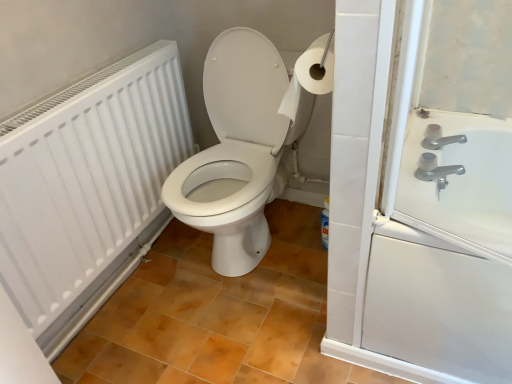
In the scene shown: Measure the distance between point (206, 179) and camera.

The depth of point (206, 179) is 5.38 feet.

Locate an element on the screen. This screenshot has height=384, width=512. satin nickel faucet at upper right is located at coordinates (435, 170).

The width and height of the screenshot is (512, 384). Find the location of `white paper at upper right`. white paper at upper right is located at coordinates (310, 76).

Does white matte radiator at left lie behind satin nickel faucet at upper right?

No.

Considering the relative positions of white matte radiator at left and satin nickel faucet at upper right in the image provided, is white matte radiator at left to the left or to the right of satin nickel faucet at upper right?

From the image, it's evident that white matte radiator at left is to the left of satin nickel faucet at upper right.

Which is in front, point (161, 84) or point (428, 164)?

Positioned in front is point (428, 164).

How many degrees apart are the facing directions of white matte radiator at left and satin nickel faucet at upper right?

The angle between the facing direction of white matte radiator at left and the facing direction of satin nickel faucet at upper right is 0.399 degrees.

Considering the relative positions of white glossy toilet at center and white paper at upper right in the image provided, is white glossy toilet at center to the left or to the right of white paper at upper right?

white glossy toilet at center is positioned on white paper at upper right's left side.

From a real-world perspective, which object rests below the other?

white glossy toilet at center is physically lower.

Based on the photo, which of these two, white glossy toilet at center or white paper at upper right, is smaller?

Answer: white paper at upper right.

What's the angular difference between white glossy toilet at center and white paper at upper right's facing directions?

There is a 92.6-degree angle between the facing directions of white glossy toilet at center and white paper at upper right.

From a real-world perspective, is white paper at upper right over white glossy toilet at center?

Yes, from a real-world perspective, white paper at upper right is on top of white glossy toilet at center.

Who is taller, white paper at upper right or white glossy toilet at center?

white glossy toilet at center.

Would you say white paper at upper right is a long distance from white glossy toilet at center?

white paper at upper right is near white glossy toilet at center, not far away.

Is white paper at upper right to the left of white glossy toilet at center from the viewer's perspective?

Incorrect, white paper at upper right is not on the left side of white glossy toilet at center.

In the scene shown: Is white paper at upper right wider or thinner than satin nickel faucet at upper right?

Clearly, white paper at upper right has more width compared to satin nickel faucet at upper right.

Is white paper at upper right not inside satin nickel faucet at upper right?

Yes, white paper at upper right is outside of satin nickel faucet at upper right.

Is white paper at upper right taller or shorter than satin nickel faucet at upper right?

Considering their sizes, white paper at upper right has more height than satin nickel faucet at upper right.

Who is bigger, white paper at upper right or satin nickel faucet at upper right?

With larger size is white paper at upper right.

Does satin nickel faucet at upper right have a lesser width compared to white paper at upper right?

Indeed, satin nickel faucet at upper right has a lesser width compared to white paper at upper right.

Is satin nickel faucet at upper right far from white paper at upper right?

satin nickel faucet at upper right is actually quite close to white paper at upper right.

Is point (442, 171) farther from viewer compared to point (310, 47)?

Yes.

Does satin nickel faucet at upper right have a smaller size compared to white paper at upper right?

Correct, satin nickel faucet at upper right occupies less space than white paper at upper right.

Is white matte radiator at left not inside white glossy toilet at center?

Yes, white matte radiator at left is outside of white glossy toilet at center.

Is white matte radiator at left behind white glossy toilet at center?

No, it is in front of white glossy toilet at center.

Does white matte radiator at left appear on the left side of white glossy toilet at center?

Correct, you'll find white matte radiator at left to the left of white glossy toilet at center.

Considering the sizes of white matte radiator at left and white glossy toilet at center in the image, is white matte radiator at left taller or shorter than white glossy toilet at center?

In the image, white matte radiator at left appears to be shorter than white glossy toilet at center.

From the picture: Can you confirm if white glossy toilet at center is wider than satin nickel faucet at upper right?

Yes, white glossy toilet at center is wider than satin nickel faucet at upper right.

Considering the relative sizes of white glossy toilet at center and satin nickel faucet at upper right in the image provided, is white glossy toilet at center taller than satin nickel faucet at upper right?

Correct, white glossy toilet at center is much taller as satin nickel faucet at upper right.

Considering the points (251, 191) and (419, 163), which point is in front, point (251, 191) or point (419, 163)?

The point (419, 163) is closer to the camera.

Considering the positions of objects white glossy toilet at center and satin nickel faucet at upper right in the image provided, who is in front, white glossy toilet at center or satin nickel faucet at upper right?

white glossy toilet at center is closer to the camera.

In order to click on radiator on the left side of satin nickel faucet at upper right in this screenshot , I will do `click(88, 189)`.

Where is `toilet below the white paper at upper right (from the image's perspective)`? toilet below the white paper at upper right (from the image's perspective) is located at coordinates (238, 150).

When comparing their distances from white glossy toilet at center, does white matte radiator at left or satin nickel faucet at upper right seem closer?

white matte radiator at left lies closer to white glossy toilet at center than the other object.

From the image, which object appears to be farther from satin nickel faucet at upper right, white glossy toilet at center or white paper at upper right?

white glossy toilet at center is positioned further to the anchor satin nickel faucet at upper right.

From the image, which object appears to be farther from satin nickel faucet at upper right, white glossy toilet at center or white matte radiator at left?

white matte radiator at left is positioned further to the anchor satin nickel faucet at upper right.

Considering their positions, is white matte radiator at left positioned further to white paper at upper right than satin nickel faucet at upper right?

Among the two, white matte radiator at left is located further to white paper at upper right.

Estimate the real-world distances between objects in this image. Which object is further from white matte radiator at left, white paper at upper right or satin nickel faucet at upper right?

The object further to white matte radiator at left is satin nickel faucet at upper right.

Considering their positions, is white matte radiator at left positioned closer to white paper at upper right than white glossy toilet at center?

Among the two, white glossy toilet at center is located nearer to white paper at upper right.

When comparing their distances from white glossy toilet at center, does white paper at upper right or white matte radiator at left seem further?

The object further to white glossy toilet at center is white paper at upper right.

From the image, which object appears to be nearer to white glossy toilet at center, white paper at upper right or satin nickel faucet at upper right?

white paper at upper right is positioned closer to the anchor white glossy toilet at center.

At what (x,y) coordinates should I click in order to perform the action: click on toilet paper located between white glossy toilet at center and satin nickel faucet at upper right in the left-right direction. Please return your answer as a coordinate pair (x, y). Looking at the image, I should click on (310, 76).

Locate an element on the screen. The image size is (512, 384). toilet paper between white matte radiator at left and satin nickel faucet at upper right is located at coordinates (310, 76).

Where is `toilet between white matte radiator at left and satin nickel faucet at upper right`? This screenshot has width=512, height=384. toilet between white matte radiator at left and satin nickel faucet at upper right is located at coordinates pyautogui.click(x=238, y=150).

Locate an element on the screen. The image size is (512, 384). toilet located between white matte radiator at left and white paper at upper right in the left-right direction is located at coordinates (238, 150).